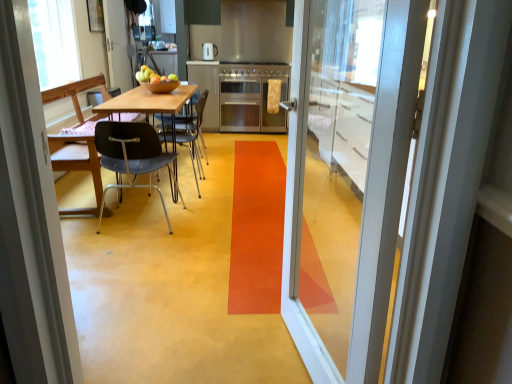
Identify the location of free location in front of black plastic chair at left, the 2th chair viewed from the right. The image size is (512, 384). (x=130, y=247).